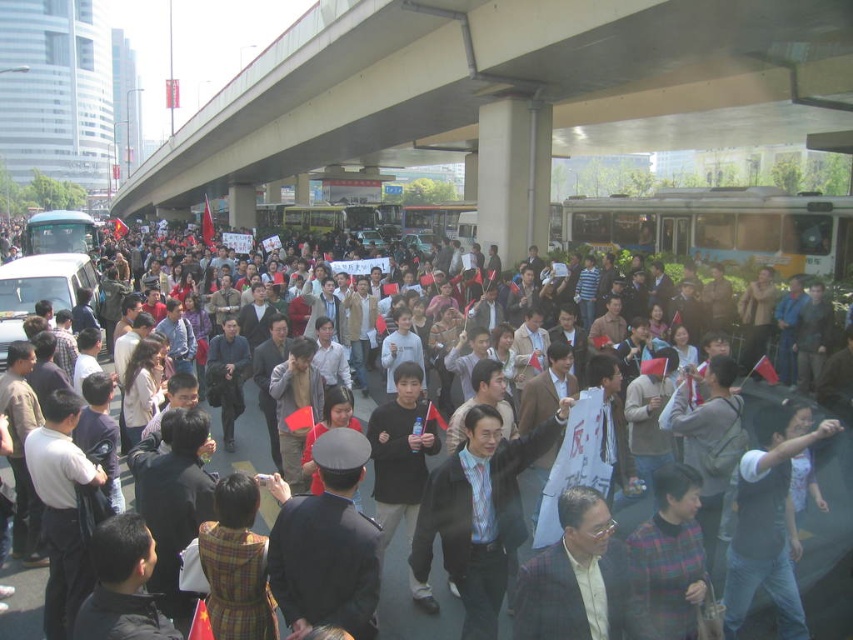
Who is shorter, dark blue suit at center or plaid suit at center?

With less height is plaid suit at center.

Can you confirm if dark blue suit at center is positioned below plaid suit at center?

Actually, dark blue suit at center is above plaid suit at center.

Does point (448, 490) lie in front of point (593, 618)?

No.

At what (x,y) coordinates should I click in order to perform the action: click on dark blue suit at center. Please return your answer as a coordinate pair (x, y). Looking at the image, I should click on (480, 512).

Which of these two, dark blue uniform at center or plaid suit at center, stands shorter?

Standing shorter between the two is plaid suit at center.

Who is lower down, dark blue uniform at center or plaid suit at center?

dark blue uniform at center is lower down.

What do you see at coordinates (828, 557) in the screenshot?
I see `dark blue uniform at center` at bounding box center [828, 557].

Locate an element on the screen. The image size is (853, 640). dark blue uniform at center is located at coordinates (828, 557).

Who is positioned more to the right, concrete bridge at upper center or plaid suit at center?

plaid suit at center

Can you confirm if concrete bridge at upper center is positioned below plaid suit at center?

No.

What do you see at coordinates (500, 83) in the screenshot? I see `concrete bridge at upper center` at bounding box center [500, 83].

Find the location of a particular element. The height and width of the screenshot is (640, 853). concrete bridge at upper center is located at coordinates (500, 83).